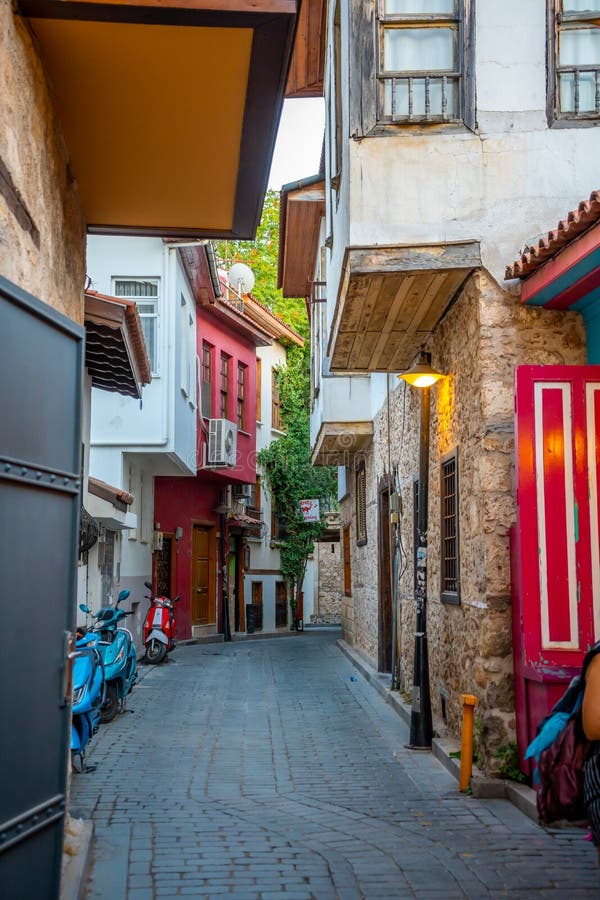
This screenshot has width=600, height=900. What are the coordinates of `shutter` in the screenshot? It's located at (362, 509).